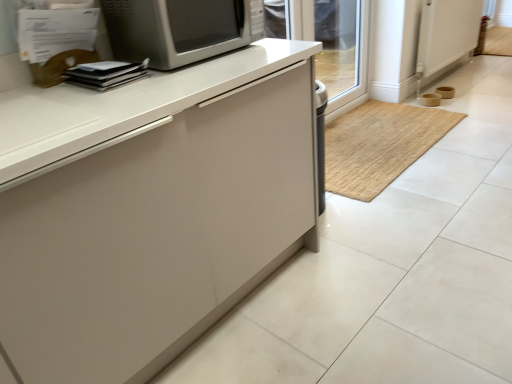
Question: Should I look upward or downward to see bamboo mat at center?

Choices:
 (A) up
 (B) down

Answer: (A)

Question: Can you confirm if bamboo mat at center is taller than matte white cabinet at center?

Choices:
 (A) yes
 (B) no

Answer: (B)

Question: Is bamboo mat at center to the right of matte white cabinet at center from the viewer's perspective?

Choices:
 (A) no
 (B) yes

Answer: (A)

Question: Is bamboo mat at center looking in the opposite direction of matte white cabinet at center?

Choices:
 (A) yes
 (B) no

Answer: (A)

Question: From a real-world perspective, is bamboo mat at center below matte white cabinet at center?

Choices:
 (A) yes
 (B) no

Answer: (B)

Question: Is bamboo mat at center at the left side of matte white cabinet at center?

Choices:
 (A) no
 (B) yes

Answer: (B)

Question: From the image's perspective, is bamboo mat at center above matte white cabinet at center?

Choices:
 (A) yes
 (B) no

Answer: (B)

Question: Is the depth of white plastic screen door at upper right less than that of transparent glass door at upper right?

Choices:
 (A) no
 (B) yes

Answer: (A)

Question: Considering the relative positions of white plastic screen door at upper right and transparent glass door at upper right in the image provided, is white plastic screen door at upper right behind transparent glass door at upper right?

Choices:
 (A) no
 (B) yes

Answer: (B)

Question: Is white plastic screen door at upper right wider than transparent glass door at upper right?

Choices:
 (A) yes
 (B) no

Answer: (B)

Question: Could you tell me if white plastic screen door at upper right is turned towards transparent glass door at upper right?

Choices:
 (A) yes
 (B) no

Answer: (B)

Question: Is white plastic screen door at upper right completely or partially outside of transparent glass door at upper right?

Choices:
 (A) no
 (B) yes

Answer: (B)

Question: From the image's perspective, is white plastic screen door at upper right under transparent glass door at upper right?

Choices:
 (A) no
 (B) yes

Answer: (A)

Question: Is matte white cabinet at center thinner than transparent glass door at upper right?

Choices:
 (A) yes
 (B) no

Answer: (B)